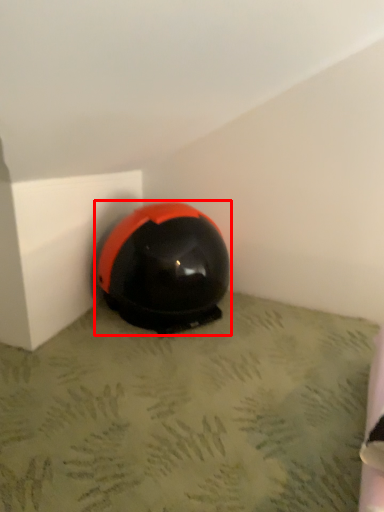
Question: From the image, what is the correct spatial relationship of helmet (annotated by the red box) in relation to concrete?

Choices:
 (A) right
 (B) left

Answer: (B)